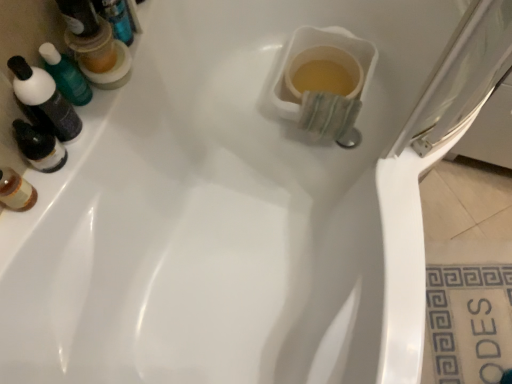
Question: From the image's perspective, is transparent plastic screen door at upper right located above translucent plastic mouthwash at upper left, the second mouthwash from the top?

Choices:
 (A) yes
 (B) no

Answer: (A)

Question: Is transparent plastic screen door at upper right positioned behind translucent plastic mouthwash at upper left, which appears as the first mouthwash when ordered from the bottom?

Choices:
 (A) no
 (B) yes

Answer: (B)

Question: Is translucent plastic mouthwash at upper left, which appears as the first mouthwash when ordered from the bottom, at the back of transparent plastic screen door at upper right?

Choices:
 (A) no
 (B) yes

Answer: (A)

Question: From a real-world perspective, does transparent plastic screen door at upper right stand above translucent plastic mouthwash at upper left, the second mouthwash from the top?

Choices:
 (A) no
 (B) yes

Answer: (A)

Question: From the image's perspective, does transparent plastic screen door at upper right appear lower than translucent plastic mouthwash at upper left, which appears as the first mouthwash when ordered from the bottom?

Choices:
 (A) yes
 (B) no

Answer: (B)

Question: In terms of width, does white ceramic tile at lower right look wider or thinner when compared to translucent plastic mouthwash at upper left, which appears as the first mouthwash when ordered from the bottom?

Choices:
 (A) wide
 (B) thin

Answer: (A)

Question: Considering their positions, is white ceramic tile at lower right located in front of or behind translucent plastic mouthwash at upper left, which appears as the first mouthwash when ordered from the bottom?

Choices:
 (A) front
 (B) behind

Answer: (B)

Question: Is white ceramic tile at lower right to the left or to the right of translucent plastic mouthwash at upper left, which appears as the first mouthwash when ordered from the bottom, in the image?

Choices:
 (A) right
 (B) left

Answer: (A)

Question: Is point (426, 317) closer or farther from the camera than point (38, 120)?

Choices:
 (A) farther
 (B) closer

Answer: (A)

Question: From a real-world perspective, is translucent plastic mouthwash at upper left, which is counted as the 1th mouthwash, starting from the top, physically located above or below translucent plastic mouthwash at upper left, the second mouthwash from the top?

Choices:
 (A) above
 (B) below

Answer: (B)

Question: Is translucent plastic mouthwash at upper left, which appears as the 2th mouthwash when ordered from the bottom, in front of or behind translucent plastic mouthwash at upper left, the second mouthwash from the top, in the image?

Choices:
 (A) behind
 (B) front

Answer: (A)

Question: Is translucent plastic mouthwash at upper left, which appears as the 2th mouthwash when ordered from the bottom, bigger or smaller than translucent plastic mouthwash at upper left, the second mouthwash from the top?

Choices:
 (A) small
 (B) big

Answer: (B)

Question: Would you say translucent plastic mouthwash at upper left, which appears as the 2th mouthwash when ordered from the bottom, is inside or outside translucent plastic mouthwash at upper left, which appears as the first mouthwash when ordered from the bottom?

Choices:
 (A) outside
 (B) inside

Answer: (A)

Question: From the image's perspective, is translucent plastic mouthwash at upper left, which is counted as the 1th mouthwash, starting from the top, positioned above or below white ceramic tile at lower right?

Choices:
 (A) above
 (B) below

Answer: (A)

Question: Is translucent plastic mouthwash at upper left, which appears as the 2th mouthwash when ordered from the bottom, taller or shorter than white ceramic tile at lower right?

Choices:
 (A) short
 (B) tall

Answer: (B)